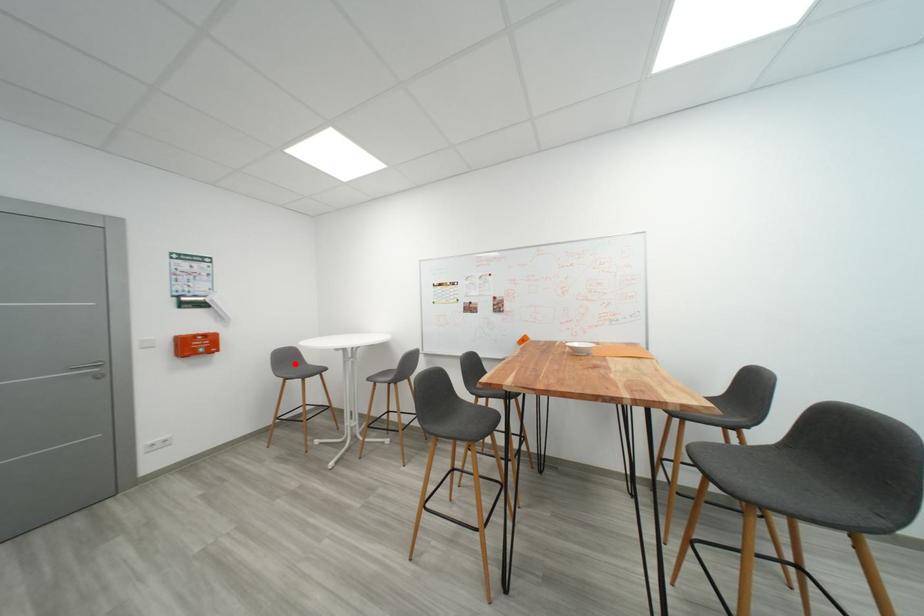
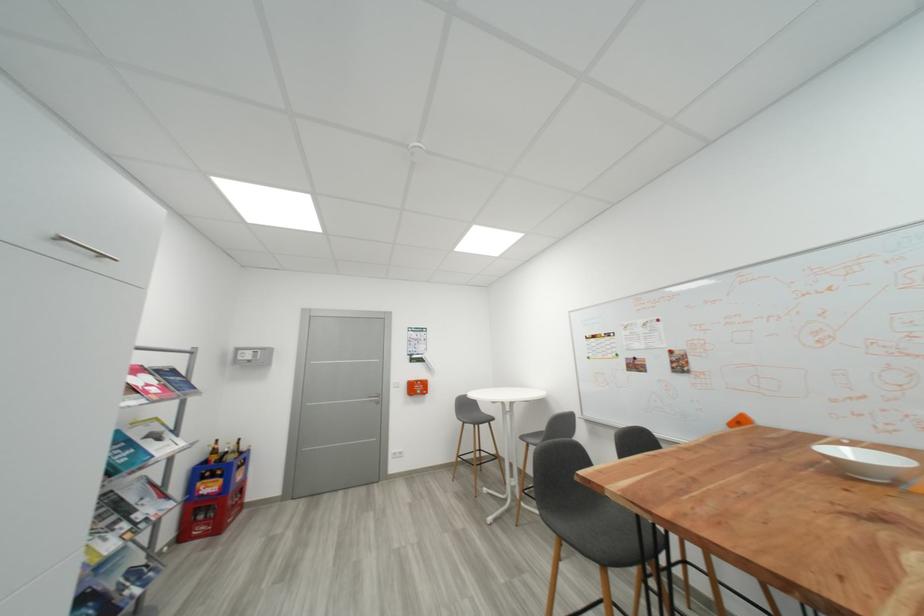
Where in the second image is the point corresponding to the highlighted location from the first image?

(473, 410)